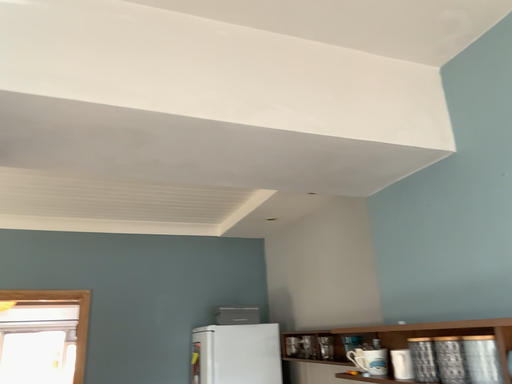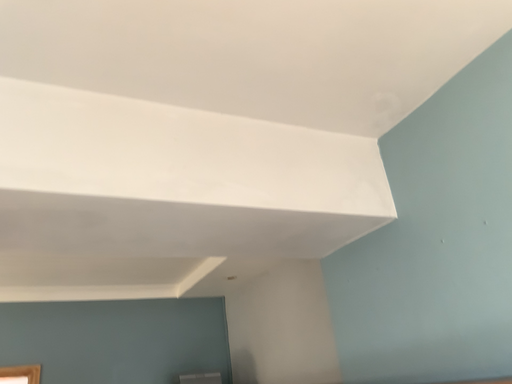
Question: How did the camera likely rotate when shooting the video?

Choices:
 (A) rotated upward
 (B) rotated downward

Answer: (A)